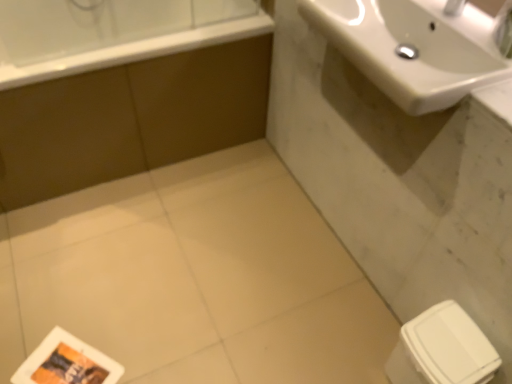
Image resolution: width=512 pixels, height=384 pixels. What do you see at coordinates (130, 119) in the screenshot? I see `brown matte bathtub at upper left` at bounding box center [130, 119].

Locate an element on the screen. The image size is (512, 384). white glossy bathtub at upper left is located at coordinates (111, 33).

Who is smaller, brown matte bathtub at upper left or white glossy bathtub at upper left?

white glossy bathtub at upper left.

Which is in front, point (135, 72) or point (96, 8)?

The point (135, 72) is in front.

In terms of height, does brown matte bathtub at upper left look taller or shorter compared to white glossy bathtub at upper left?

Considering their sizes, brown matte bathtub at upper left has more height than white glossy bathtub at upper left.

Is brown matte bathtub at upper left inside the boundaries of white glossy bathtub at upper left, or outside?

brown matte bathtub at upper left is not inside white glossy bathtub at upper left, it's outside.

Does point (176, 49) come in front of point (48, 190)?

Yes, point (176, 49) is closer to viewer.

From a real-world perspective, is white glossy bathtub at upper left located beneath brown matte bathtub at upper left?

No, from a real-world perspective, white glossy bathtub at upper left is not below brown matte bathtub at upper left.

Which is more to the right, white glossy bathtub at upper left or brown matte bathtub at upper left?

white glossy bathtub at upper left is more to the right.

Does white glossy sink at upper right come behind brown matte bathtub at upper left?

No, white glossy sink at upper right is closer to the camera.

Is white glossy sink at upper right bigger or smaller than brown matte bathtub at upper left?

Clearly, white glossy sink at upper right is smaller in size than brown matte bathtub at upper left.

Is white glossy bathtub at upper left located within white glossy sink at upper right?

No, white glossy bathtub at upper left is located outside of white glossy sink at upper right.

Considering the sizes of white glossy sink at upper right and white glossy bathtub at upper left in the image, is white glossy sink at upper right taller or shorter than white glossy bathtub at upper left?

white glossy sink at upper right is shorter than white glossy bathtub at upper left.

Who is more distant, white glossy sink at upper right or white glossy bathtub at upper left?

white glossy bathtub at upper left.

Where is `bathtub directly beneath the white glossy sink at upper right (from a real-world perspective)`? bathtub directly beneath the white glossy sink at upper right (from a real-world perspective) is located at coordinates (111, 33).

Does point (173, 49) come in front of point (442, 33)?

No, it is behind (442, 33).

Who is more distant, white glossy bathtub at upper left or white glossy sink at upper right?

A: white glossy bathtub at upper left is behind.

From the image's perspective, is white glossy bathtub at upper left located above or below white glossy sink at upper right?

Clearly, from the image's perspective, white glossy bathtub at upper left is above white glossy sink at upper right.

The width and height of the screenshot is (512, 384). Find the location of `sink in front of the white glossy bathtub at upper left`. sink in front of the white glossy bathtub at upper left is located at coordinates (415, 46).

How many degrees apart are the facing directions of brown matte bathtub at upper left and white glossy sink at upper right?

89.7 degrees separate the facing orientations of brown matte bathtub at upper left and white glossy sink at upper right.

How much distance is there between brown matte bathtub at upper left and white glossy sink at upper right?

A distance of 33.54 inches exists between brown matte bathtub at upper left and white glossy sink at upper right.

From a real-world perspective, is brown matte bathtub at upper left located beneath white glossy sink at upper right?

Yes.

Is point (0, 167) positioned before point (391, 49)?

No, (0, 167) is behind (391, 49).

Where is `bathtub above the brown matte bathtub at upper left (from a real-world perspective)`? Image resolution: width=512 pixels, height=384 pixels. bathtub above the brown matte bathtub at upper left (from a real-world perspective) is located at coordinates (111, 33).

Identify the location of bath on the left side of white glossy bathtub at upper left. (130, 119).

Estimate the real-world distances between objects in this image. Which object is closer to brown matte bathtub at upper left, white glossy bathtub at upper left or white glossy sink at upper right?

Based on the image, white glossy bathtub at upper left appears to be nearer to brown matte bathtub at upper left.

Looking at this image, when comparing their distances from white glossy bathtub at upper left, does brown matte bathtub at upper left or white glossy sink at upper right seem further?

white glossy sink at upper right lies further to white glossy bathtub at upper left than the other object.

Estimate the real-world distances between objects in this image. Which object is further from white glossy bathtub at upper left, white glossy sink at upper right or brown matte bathtub at upper left?

Among the two, white glossy sink at upper right is located further to white glossy bathtub at upper left.

Considering their positions, is white glossy sink at upper right positioned closer to brown matte bathtub at upper left than white glossy bathtub at upper left?

Based on the image, white glossy bathtub at upper left appears to be nearer to brown matte bathtub at upper left.

Considering their positions, is white glossy bathtub at upper left positioned closer to white glossy sink at upper right than brown matte bathtub at upper left?

white glossy bathtub at upper left is closer to white glossy sink at upper right.

Estimate the real-world distances between objects in this image. Which object is closer to white glossy sink at upper right, brown matte bathtub at upper left or white glossy bathtub at upper left?

Based on the image, white glossy bathtub at upper left appears to be nearer to white glossy sink at upper right.

Identify the location of bathtub between brown matte bathtub at upper left and white glossy sink at upper right from left to right. (111, 33).